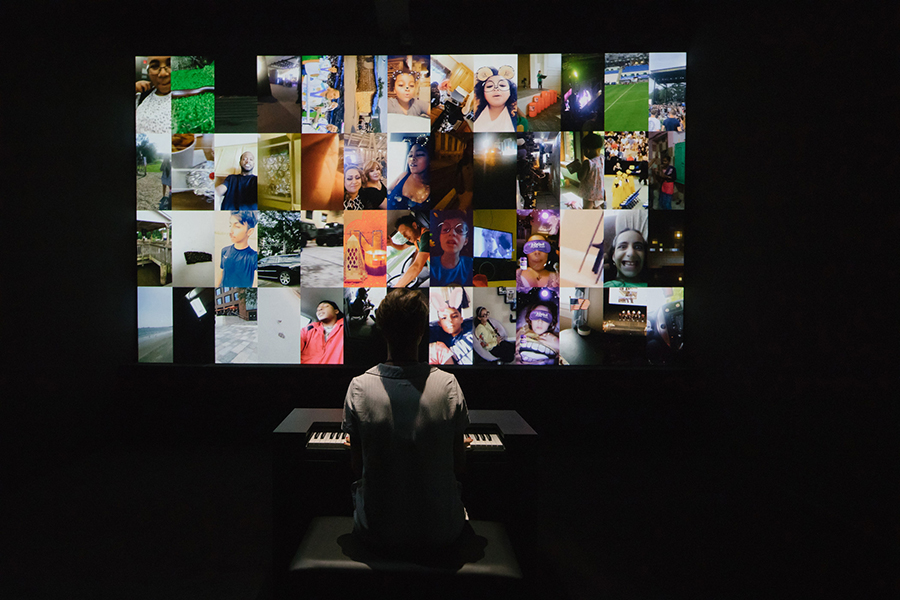
Find the location of a particular element. The height and width of the screenshot is (600, 900). black seat cushion is located at coordinates (495, 563).